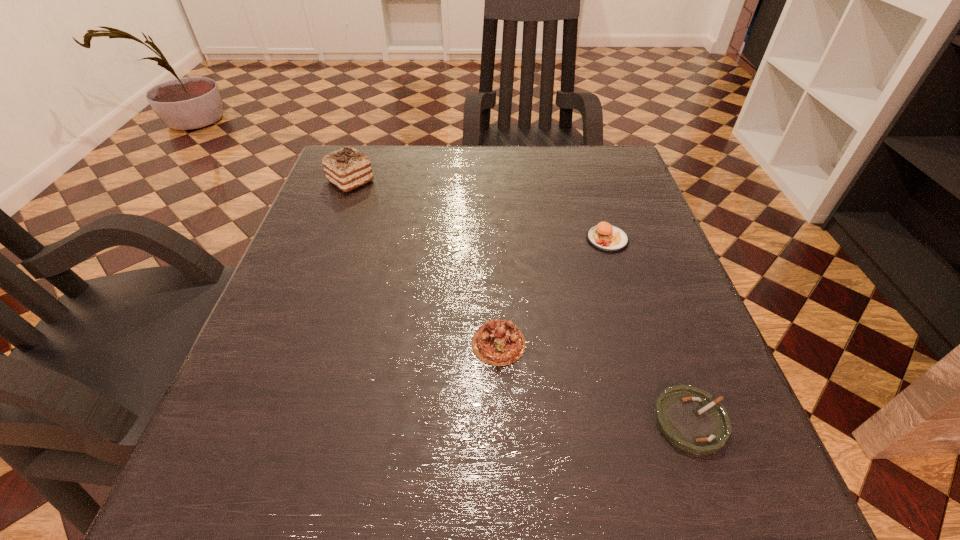
Where is `free space at the far left corner of the desktop`? The height and width of the screenshot is (540, 960). free space at the far left corner of the desktop is located at coordinates (374, 154).

Find the location of a particular element. The width and height of the screenshot is (960, 540). free space at the far right corner of the desktop is located at coordinates (623, 170).

The image size is (960, 540). In the image, there is a desktop. Find the location of `vacant space at the near right corner`. vacant space at the near right corner is located at coordinates (676, 519).

At what (x,y) coordinates should I click in order to perform the action: click on free space between the third nearest object and the ashtray. Please return your answer as a coordinate pair (x, y). Image resolution: width=960 pixels, height=540 pixels. Looking at the image, I should click on (649, 330).

At what (x,y) coordinates should I click in order to perform the action: click on vacant space in between the nearest object and the leftmost object. Please return your answer as a coordinate pair (x, y). The width and height of the screenshot is (960, 540). Looking at the image, I should click on (520, 301).

In order to click on empty space that is in between the right chocolate cake and the patty in this screenshot , I will do `click(553, 291)`.

Where is `free spot between the shortest object and the right chocolate cake`? Image resolution: width=960 pixels, height=540 pixels. free spot between the shortest object and the right chocolate cake is located at coordinates (594, 382).

You are a GUI agent. You are given a task and a screenshot of the screen. Output one action in this format:
    pyautogui.click(x=<x>, y=<y>)
    Task: Click on the empty space that is in between the third nearest object and the shortest object
    This screenshot has width=960, height=540.
    Given the screenshot: What is the action you would take?
    pyautogui.click(x=649, y=330)

Locate an element on the screen. Image resolution: width=960 pixels, height=540 pixels. vacant space that's between the farthest object and the shortest object is located at coordinates (520, 301).

Where is `free space between the ashtray and the shorter chocolate cake`? free space between the ashtray and the shorter chocolate cake is located at coordinates (594, 382).